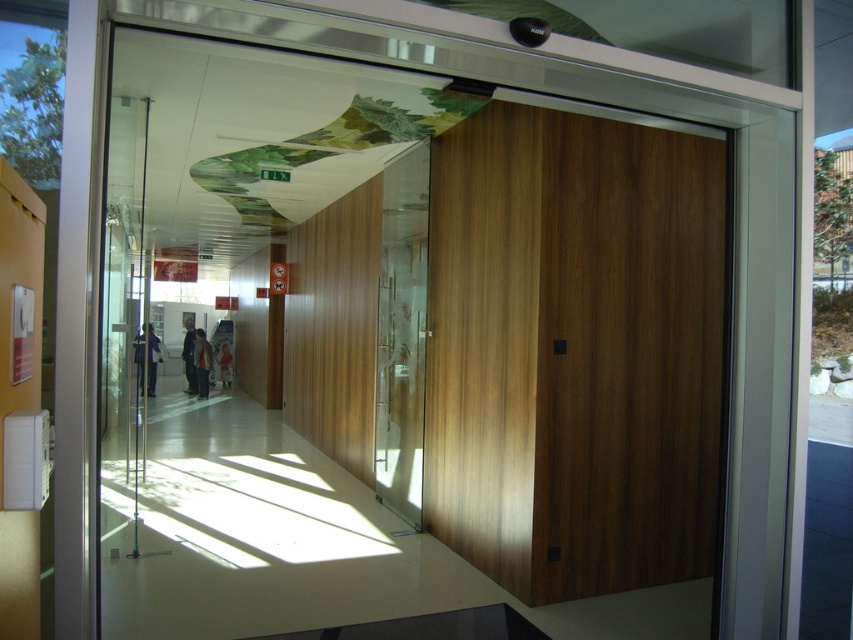
Between wooden door at right and purple fabric at center, which one appears on the left side from the viewer's perspective?

From the viewer's perspective, purple fabric at center appears more on the left side.

Between wooden door at right and purple fabric at center, which one has more height?

With more height is wooden door at right.

At what (x,y) coordinates should I click in order to perform the action: click on wooden door at right. Please return your answer as a coordinate pair (x, y). The image size is (853, 640). Looking at the image, I should click on (573, 349).

Can you confirm if dark blue jeans at center is positioned below light brown leather jacket at center?

Correct, dark blue jeans at center is located below light brown leather jacket at center.

Does point (193, 339) come closer to viewer compared to point (221, 356)?

Yes, it is in front of point (221, 356).

Does point (189, 368) come farther from viewer compared to point (227, 371)?

No, (189, 368) is closer to viewer.

Identify the location of dark blue jeans at center. (189, 355).

Does point (198, 333) lie in front of point (225, 378)?

That is True.

Which is in front, point (204, 360) or point (216, 364)?

Positioned in front is point (204, 360).

Locate an element on the screen. dark brown leather jacket at center is located at coordinates (201, 362).